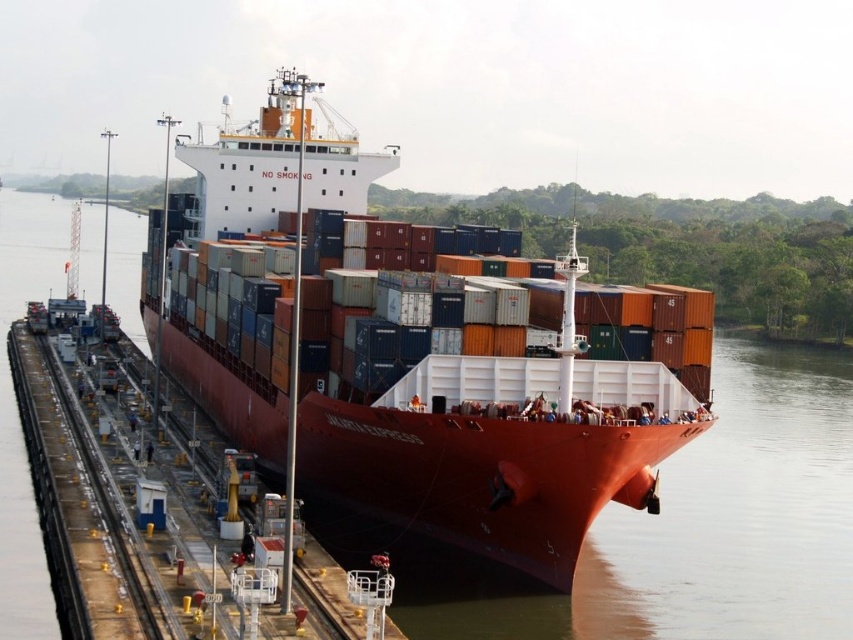
Does point (502, 401) lie behind point (643, 360)?

No, (502, 401) is in front of (643, 360).

Does matte red container ship at center have a lesser width compared to orange matte container ship at center?

Yes, matte red container ship at center is thinner than orange matte container ship at center.

Is point (326, 456) positioned in front of point (260, 312)?

Yes.

You are a GUI agent. You are given a task and a screenshot of the screen. Output one action in this format:
    pyautogui.click(x=<x>, y=<y>)
    Task: Click on the matte red container ship at center
    This screenshot has height=640, width=853.
    Given the screenshot: What is the action you would take?
    pyautogui.click(x=399, y=365)